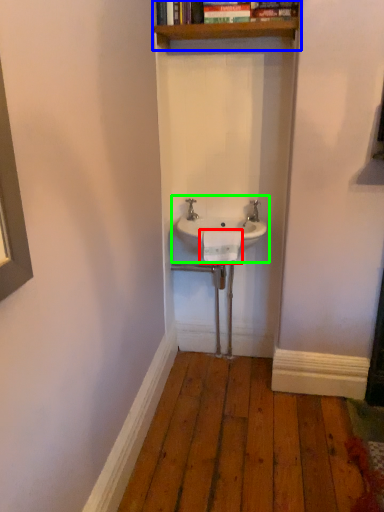
Question: Which is farther away from towel bar (highlighted by a red box)? shelf (highlighted by a blue box) or sink (highlighted by a green box)?

Choices:
 (A) shelf
 (B) sink

Answer: (A)